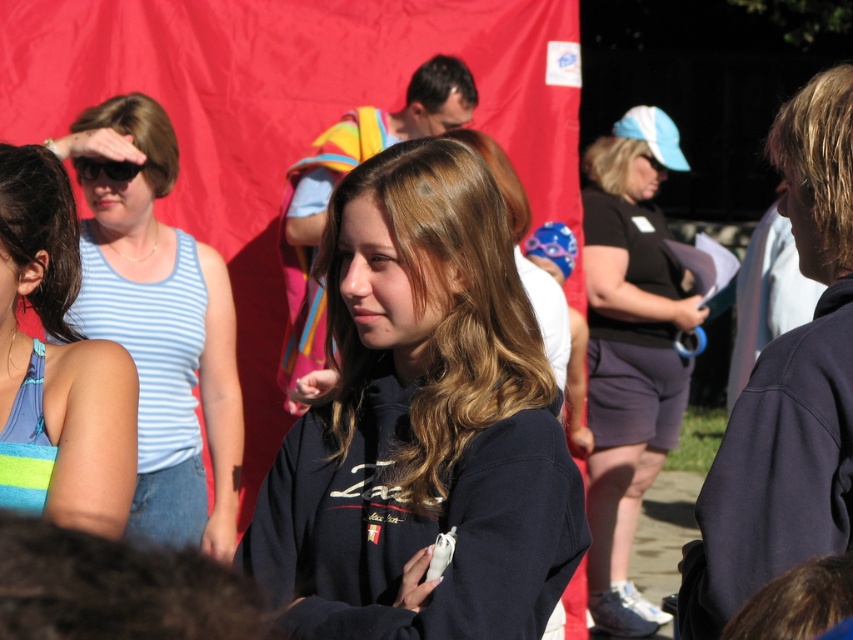
From the picture: Is light blue striped tank top at left wider than dark brown hair at left?

Yes, light blue striped tank top at left is wider than dark brown hair at left.

Is light blue striped tank top at left to the right of dark brown hair at left from the viewer's perspective?

Incorrect, light blue striped tank top at left is not on the right side of dark brown hair at left.

Between point (212, 374) and point (33, 232), which one is positioned behind?

The point (212, 374) is behind.

Locate an element on the screen. This screenshot has width=853, height=640. light blue striped tank top at left is located at coordinates (160, 324).

Does black t-shirt at center have a lesser width compared to black plastic sunglasses at upper left?

No.

Is black t-shirt at center to the right of black plastic sunglasses at upper left from the viewer's perspective?

Indeed, black t-shirt at center is positioned on the right side of black plastic sunglasses at upper left.

Which is in front, point (670, 132) or point (79, 166)?

Point (79, 166)

Where is `black t-shirt at center`? Image resolution: width=853 pixels, height=640 pixels. black t-shirt at center is located at coordinates (630, 349).

Who is shorter, brown smooth hair at center or dark brown hair at upper center?

dark brown hair at upper center

What are the coordinates of `brown smooth hair at center` in the screenshot? It's located at (498, 177).